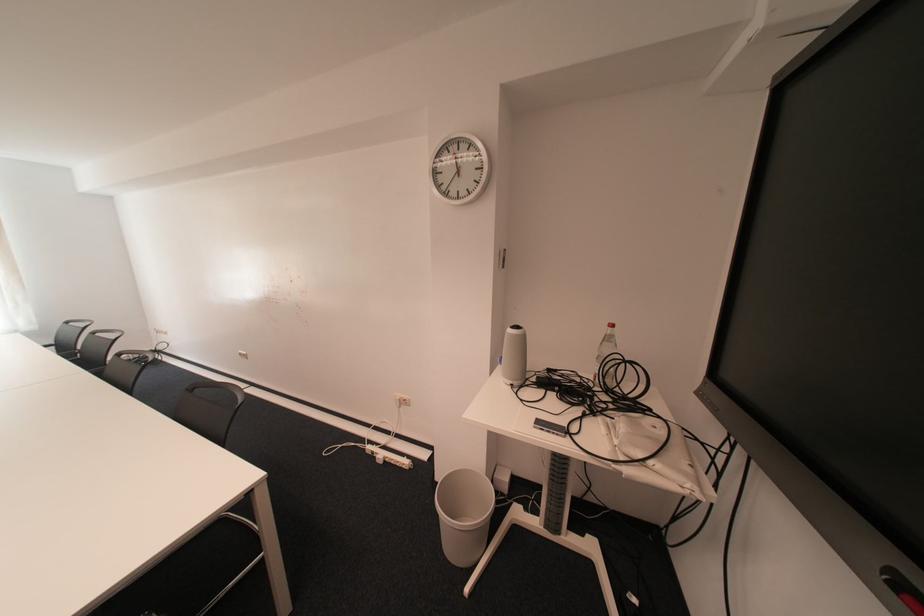
Image resolution: width=924 pixels, height=616 pixels. Identify the location of white wall clock. (458, 169).